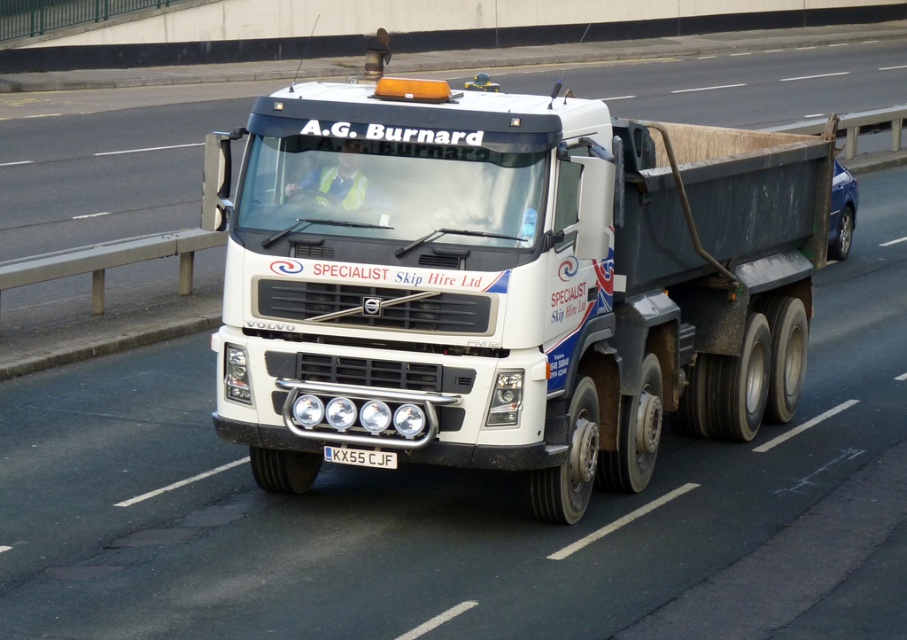
What do you see at coordinates (506, 282) in the screenshot? I see `white matte truck at center` at bounding box center [506, 282].

Does white matte truck at center appear over black metal license plate at center?

Yes, white matte truck at center is above black metal license plate at center.

Which is behind, point (714, 204) or point (340, 451)?

Positioned behind is point (714, 204).

This screenshot has height=640, width=907. I want to click on white matte truck at center, so click(506, 282).